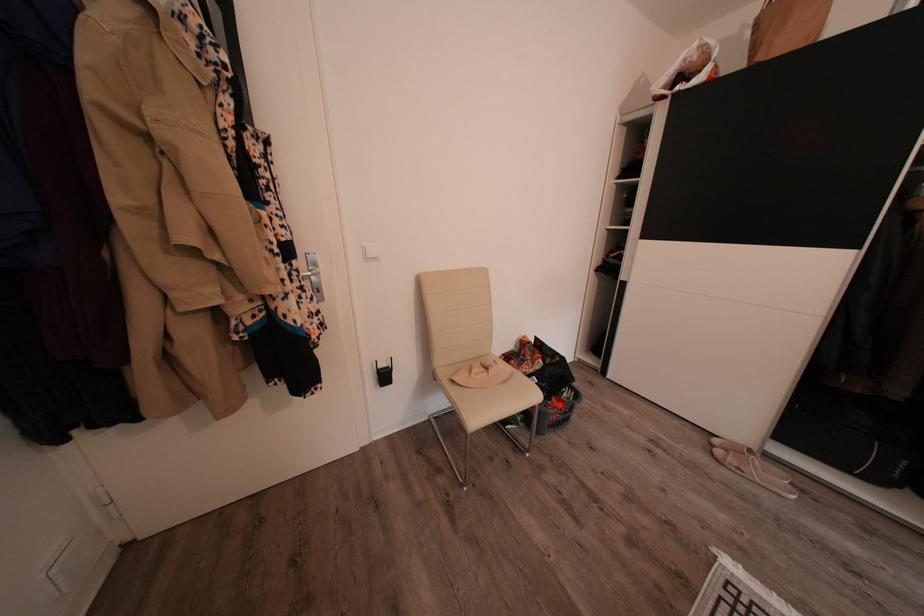
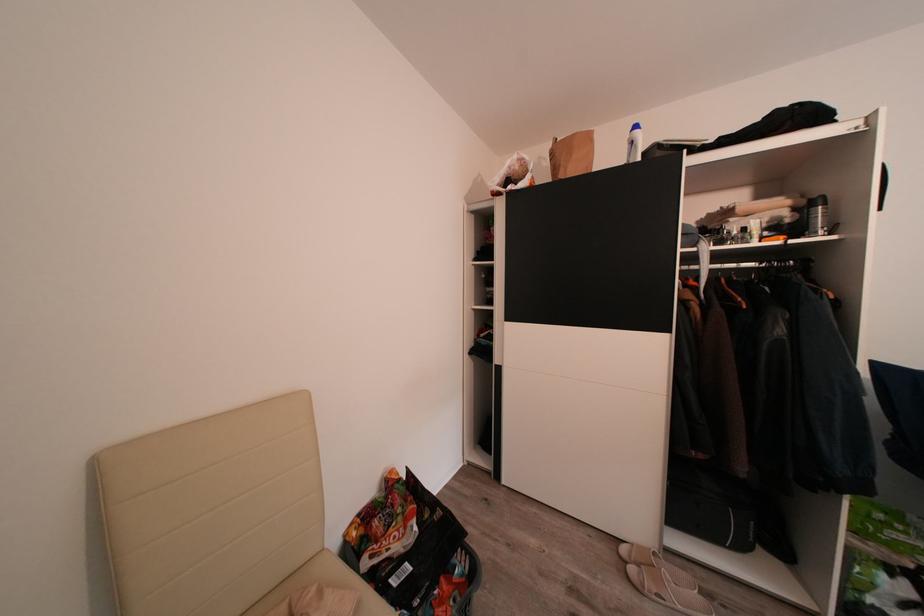
Question: I am providing you with two images of the same scene from different viewpoints. In image1, a red point is highlighted. Considering the same 3D point in image2, which of the following is correct?

Choices:
 (A) It is closer
 (B) It is farther

Answer: (A)